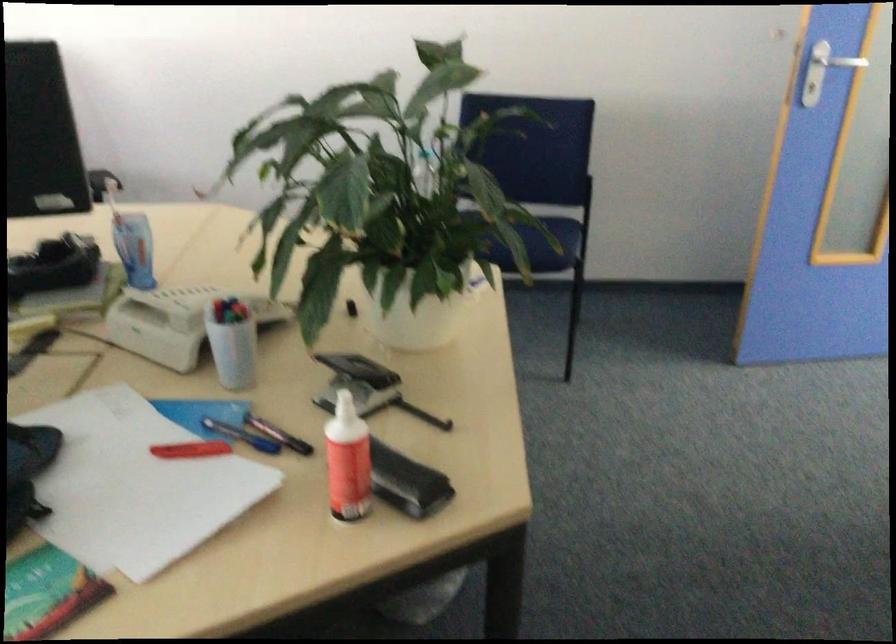
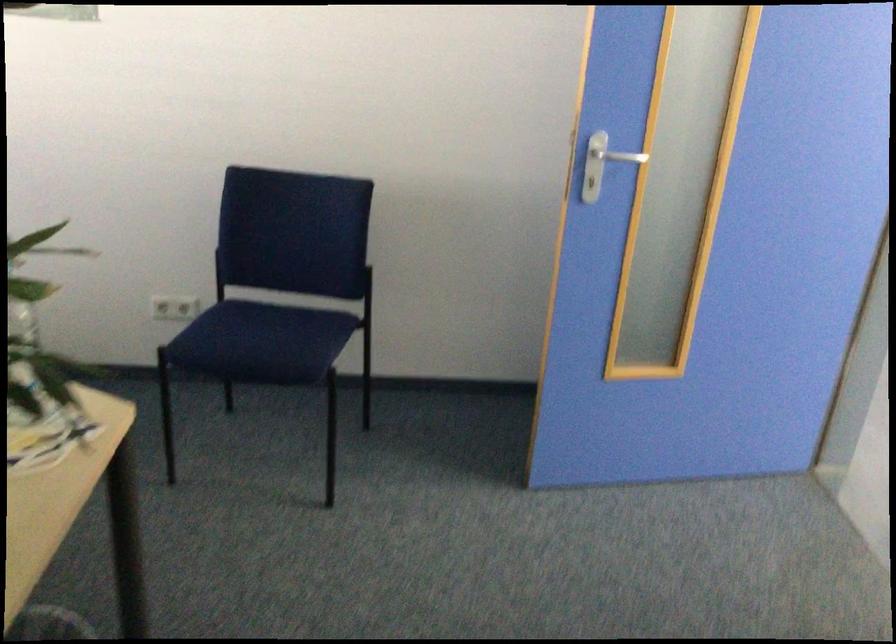
Question: Based on the continuous images, in which direction is the camera rotating? Reply with the corresponding letter.

Choices:
 (A) Left
 (B) Right
 (C) Up
 (D) Down

Answer: (C)